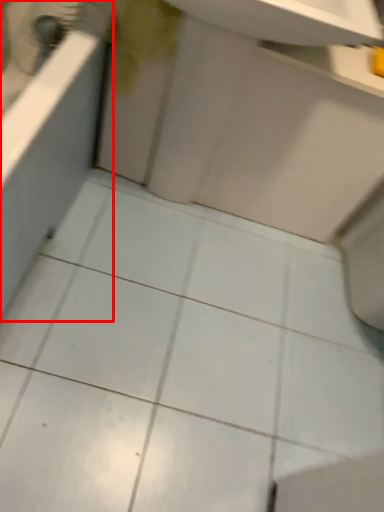
Question: Observing the image, what is the correct spatial positioning of bath (annotated by the red box) in reference to sink?

Choices:
 (A) left
 (B) right

Answer: (A)